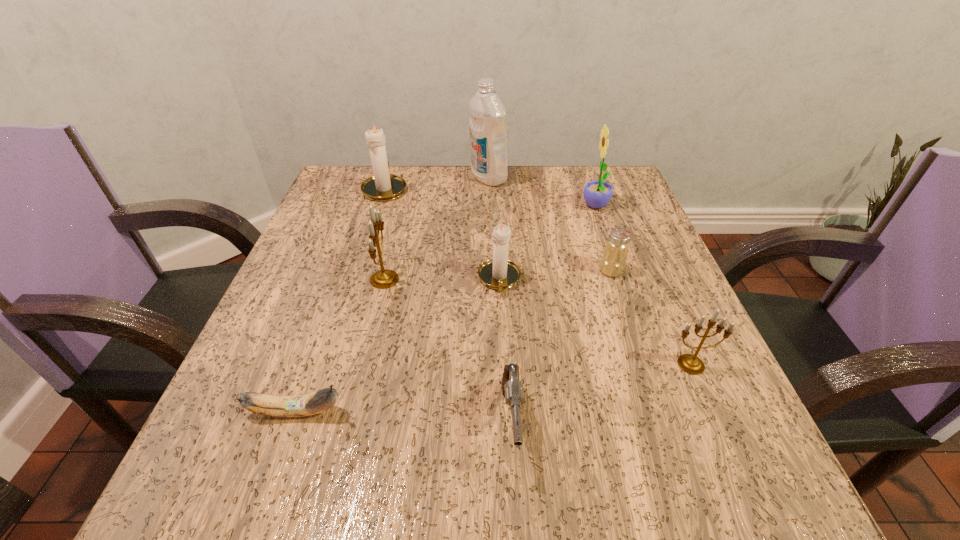
You are a GUI agent. You are given a task and a screenshot of the screen. Output one action in this format:
    pyautogui.click(x=<x>, y=<y>)
    Task: Click on the vacant space that's between the shortest object and the white detergent
    
    Given the screenshot: What is the action you would take?
    pyautogui.click(x=393, y=294)

Locate an element on the screen. The image size is (960, 540). free point between the detergent and the farther gold candelabrum is located at coordinates [437, 228].

The width and height of the screenshot is (960, 540). In order to click on free point between the sunflower and the saltshaker in this screenshot , I will do `click(604, 239)`.

The width and height of the screenshot is (960, 540). Identify the location of free space between the detergent and the nearer white candle holder. (493, 228).

At what (x,y) coordinates should I click in order to perform the action: click on vacant region between the farther gold candelabrum and the bigger white candle holder. Please return your answer as a coordinate pair (x, y). This screenshot has width=960, height=540. Looking at the image, I should click on (385, 234).

At what (x,y) coordinates should I click in order to perform the action: click on free point between the bigger white candle holder and the second candelabrum from right to left. Please return your answer as a coordinate pair (x, y). This screenshot has height=540, width=960. Looking at the image, I should click on (443, 234).

I want to click on empty space that is in between the saltshaker and the banana, so click(454, 341).

Locate an element on the screen. The image size is (960, 540). free space between the tallest object and the left gold candelabrum is located at coordinates (437, 228).

Where is `free space between the third nearest object and the farther white candle holder`? The height and width of the screenshot is (540, 960). free space between the third nearest object and the farther white candle holder is located at coordinates (538, 276).

Find the location of `empty space that is in between the sunflower and the saltshaker`. empty space that is in between the sunflower and the saltshaker is located at coordinates (604, 239).